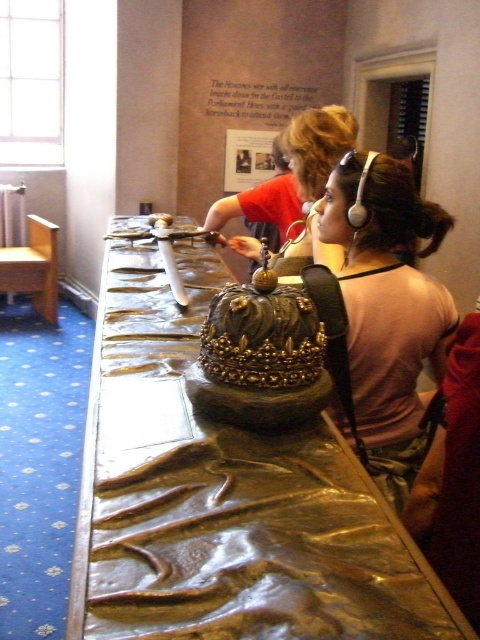
Question: Which of the following is the farthest from the observer?

Choices:
 (A) white glossy plate at center
 (B) gold polished wood table at center
 (C) pink fabric at center

Answer: (A)

Question: Among these objects, which one is nearest to the camera?

Choices:
 (A) matte gold crown at center
 (B) white glossy plate at center

Answer: (A)

Question: Which point is closer to the camera?

Choices:
 (A) (436, 326)
 (B) (211, 602)
 (C) (155, 225)

Answer: (B)

Question: Can you confirm if pink fabric at center is positioned below white glossy plate at center?

Choices:
 (A) yes
 (B) no

Answer: (A)

Question: Where is gold polished wood table at center located in relation to white glossy plate at center in the image?

Choices:
 (A) left
 (B) right

Answer: (B)

Question: Is gold polished wood table at center bigger than matte gold crown at center?

Choices:
 (A) yes
 (B) no

Answer: (A)